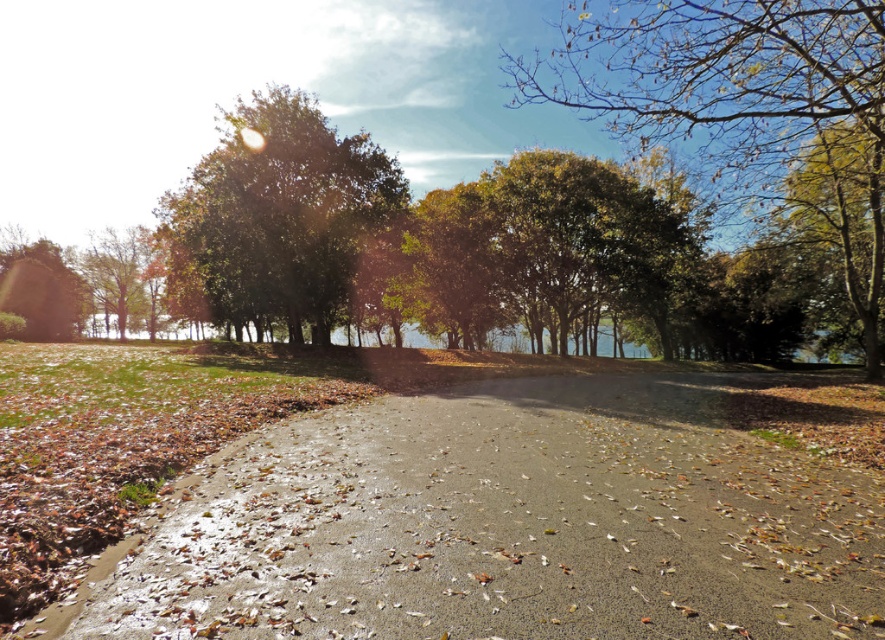
Question: Which object is closer to the camera taking this photo?

Choices:
 (A) green leafy tree at upper center
 (B) gray asphalt road at center

Answer: (B)

Question: Can you confirm if green leafy tree at upper left is positioned to the left of green matte tree at lower left?

Choices:
 (A) no
 (B) yes

Answer: (A)

Question: Considering the relative positions of gray asphalt road at center and green matte tree at lower left in the image provided, where is gray asphalt road at center located with respect to green matte tree at lower left?

Choices:
 (A) below
 (B) above

Answer: (A)

Question: Which point is farther from the camera taking this photo?

Choices:
 (A) (35, 289)
 (B) (222, 516)
 (C) (348, 301)
 (D) (728, 180)

Answer: (A)

Question: Which point is closer to the camera?

Choices:
 (A) (114, 580)
 (B) (582, 108)

Answer: (A)

Question: Is the position of green leafy tree at upper center less distant than that of green leafy tree at upper left?

Choices:
 (A) yes
 (B) no

Answer: (A)